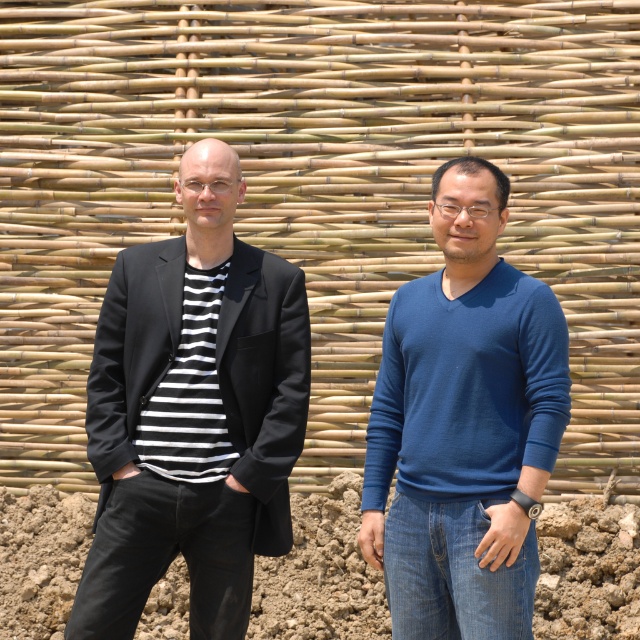
You are a photographer setting up for a group photo. You notice two people in black attire on the left side of the frame. The first person is wearing a black matte blazer at left, and the second is wearing a black matte suit at left. Which of these two is positioned further to the left in the image?

The black matte blazer at left is positioned further to the left compared to the black matte suit at left, as it is explicitly stated to be to the left of the suit.

In the scene shown: You are a photographer setting up for a portrait shoot. You want to ensure that both the black matte suit at left and the blue smooth sweater at center are clearly visible in the frame. Based on their positions, which clothing item is positioned lower in the image?

The black matte suit at left is positioned lower in the image than the blue smooth sweater at center, so it is below it.

You are a photographer planning to take a group photo of the black matte suit at left and the blue smooth sweater at center. You want to ensure both subjects are framed properly. Which subject should you adjust the camera angle to focus on first to account for their size difference?

The black matte suit at left has a lesser width compared to the blue smooth sweater at center, so you should focus on the blue smooth sweater at center first to account for its larger size.